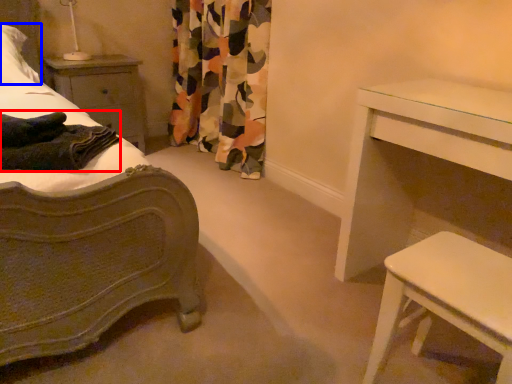
Question: Which of the following is the closest to the observer, blanket (highlighted by a red box) or pillow (highlighted by a blue box)?

Choices:
 (A) blanket
 (B) pillow

Answer: (A)